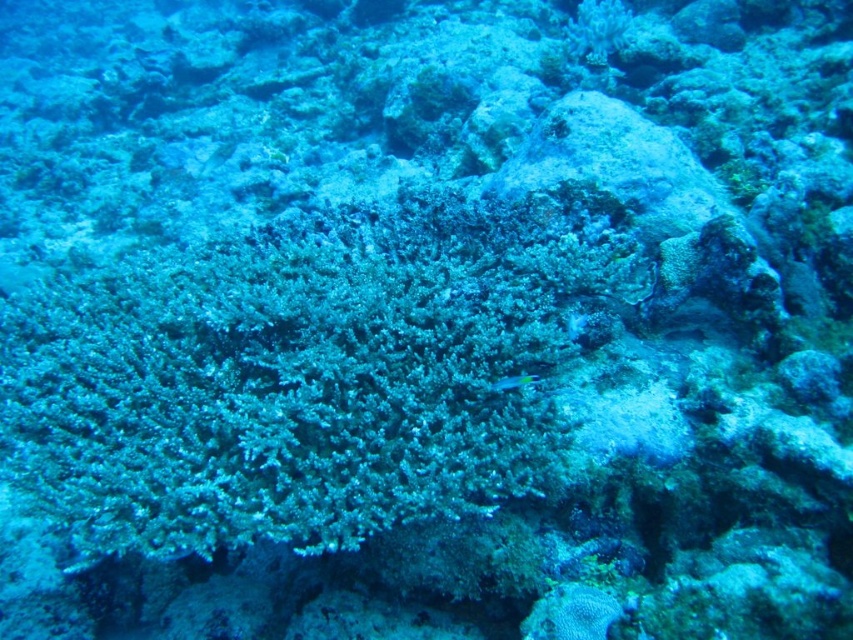
You are a diver swimming in the underwater scene. You see two points marked in the image. Which point is closer to you, point (392, 291) or point (498, 380)?

Point (392, 291) is closer to you because it is further to the viewer than point (498, 380).

Based on the photo, you are a marine biologist observing this underwater scene. You notice the green matte coral at center and the shiny blue fish at center. Which object occupies more space in the image?

The green matte coral at center is bigger than the shiny blue fish at center, so it occupies more space in the image.